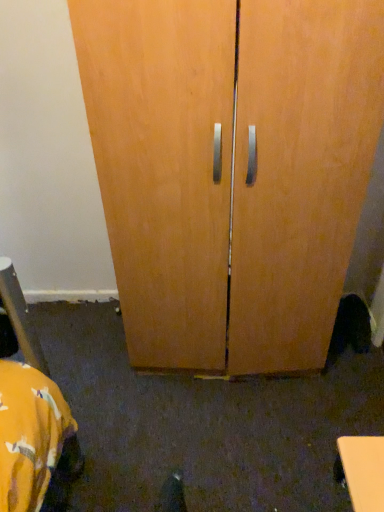
Locate an element on the screen. This screenshot has width=384, height=512. metallic silver canister at lower left is located at coordinates (20, 317).

What is the approximate height of metallic silver canister at lower left?

13.51 inches.

Image resolution: width=384 pixels, height=512 pixels. Describe the element at coordinates (20, 317) in the screenshot. I see `metallic silver canister at lower left` at that location.

Find the location of a particular element. metallic silver canister at lower left is located at coordinates (20, 317).